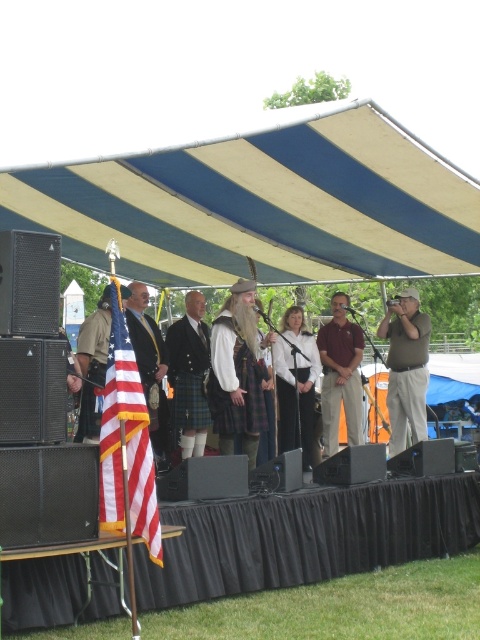
Question: Considering the real-world distances, which object is farthest from the plaid kilt at center?

Choices:
 (A) red-white striped fabric flag at left
 (B) brown leather jacket at center
 (C) blue striped canopy at upper center
 (D) matte black kilt at center

Answer: (A)

Question: Does matte black kilt at center appear over brown leather jacket at center?

Choices:
 (A) no
 (B) yes

Answer: (B)

Question: Can you confirm if red-white striped fabric flag at left is thinner than white fabric dress at center?

Choices:
 (A) yes
 (B) no

Answer: (A)

Question: Which object is the closest to the matte black suit at center?

Choices:
 (A) white fabric dress at center
 (B) matte black kilt at center
 (C) plaid kilt at center

Answer: (B)

Question: Which of the following is the farthest from the observer?

Choices:
 (A) (117, 499)
 (B) (184, 321)
 (C) (288, 122)

Answer: (B)

Question: Observing the image, what is the correct spatial positioning of red-white striped fabric flag at left in reference to white fabric dress at center?

Choices:
 (A) right
 (B) left

Answer: (B)